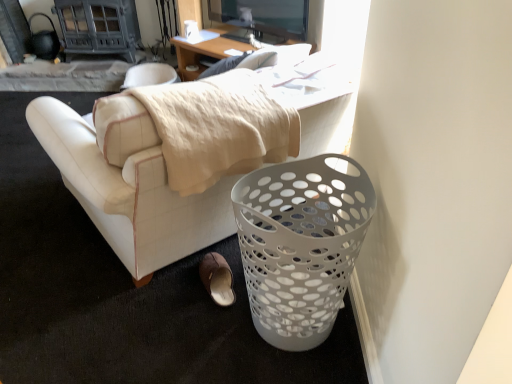
Question: Is brown suede slipper at lower center to the left or to the right of white perforated trash bin at lower right in the image?

Choices:
 (A) left
 (B) right

Answer: (A)

Question: Is point (204, 274) closer or farther from the camera than point (260, 306)?

Choices:
 (A) farther
 (B) closer

Answer: (A)

Question: Based on their relative distances, which object is nearer to the white leather couch at center?

Choices:
 (A) brown suede slipper at lower center
 (B) white perforated trash bin at lower right

Answer: (B)

Question: Estimate the real-world distances between objects in this image. Which object is farther from the brown suede slipper at lower center?

Choices:
 (A) white perforated trash bin at lower right
 (B) white leather couch at center

Answer: (A)